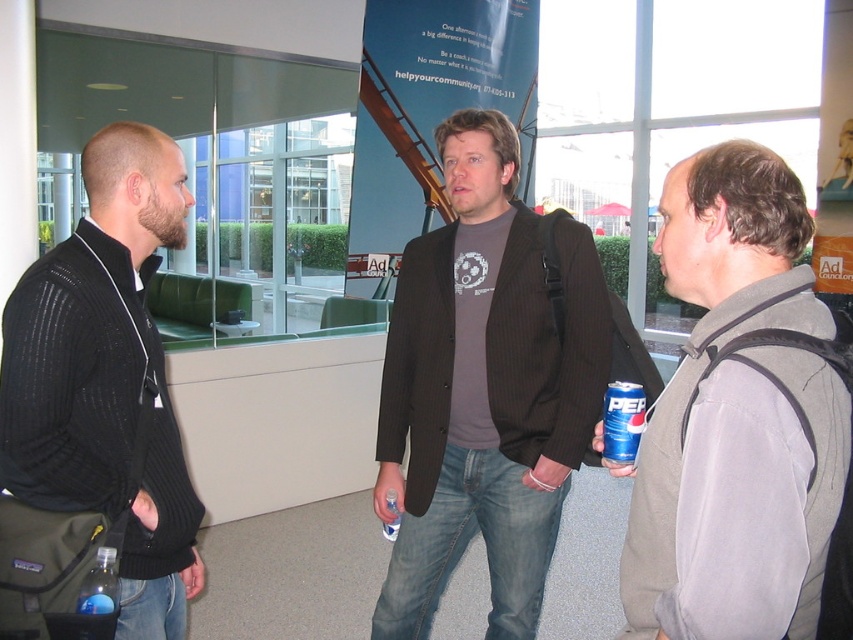
Can you confirm if gray fleece vest at center is shorter than translucent blue bottle at lower left?

In fact, gray fleece vest at center may be taller than translucent blue bottle at lower left.

Who is more distant from viewer, (711, 180) or (106, 636)?

Point (106, 636)

I want to click on gray fleece vest at center, so click(x=741, y=422).

Between gray fleece vest at center and blue metallic can at center right, which one is positioned higher?

gray fleece vest at center is above.

Can you confirm if gray fleece vest at center is thinner than blue metallic can at center right?

No.

Between point (705, 490) and point (619, 410), which one is positioned in front?

Point (705, 490)

The width and height of the screenshot is (853, 640). I want to click on gray fleece vest at center, so [x=741, y=422].

Is blue metallic can at center right to the left of translucent blue bottle at lower left from the viewer's perspective?

Incorrect, blue metallic can at center right is not on the left side of translucent blue bottle at lower left.

Does blue metallic can at center right have a lesser height compared to translucent blue bottle at lower left?

No, blue metallic can at center right is not shorter than translucent blue bottle at lower left.

Between point (619, 406) and point (112, 548), which one is positioned in front?

Point (112, 548) is more forward.

At what (x,y) coordinates should I click in order to perform the action: click on blue metallic can at center right. Please return your answer as a coordinate pair (x, y). Looking at the image, I should click on (622, 420).